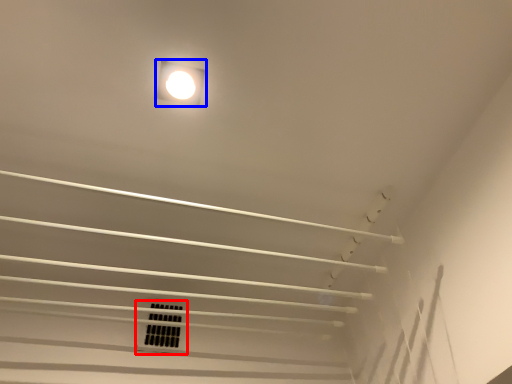
Question: Which point is further to the camera, window (highlighted by a red box) or lamp (highlighted by a blue box)?

Choices:
 (A) window
 (B) lamp

Answer: (A)